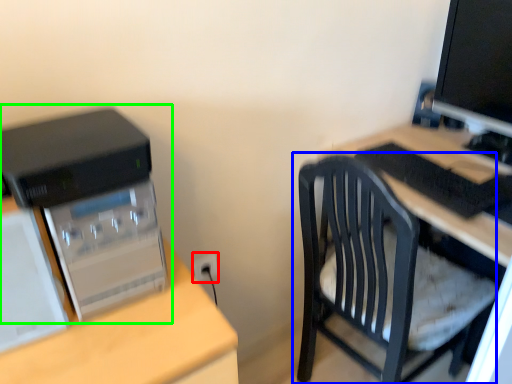
Question: Which object is positioned closest to electric outlet (highlighted by a red box)? Select from chair (highlighted by a blue box) and computer tower (highlighted by a green box).

Choices:
 (A) chair
 (B) computer tower

Answer: (A)